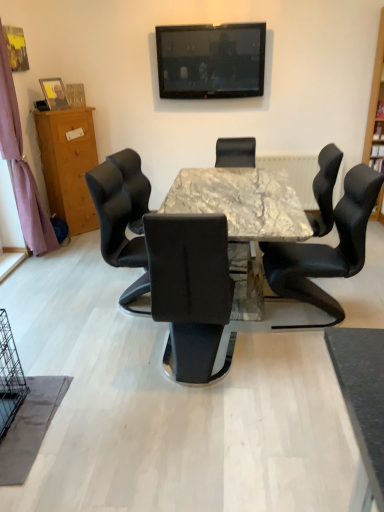
Question: Is wooden cabinet at left behind black glossy television at upper center?

Choices:
 (A) yes
 (B) no

Answer: (B)

Question: From a real-world perspective, is wooden cabinet at left positioned under black glossy television at upper center based on gravity?

Choices:
 (A) yes
 (B) no

Answer: (A)

Question: Is wooden cabinet at left located outside black glossy television at upper center?

Choices:
 (A) no
 (B) yes

Answer: (B)

Question: Is wooden cabinet at left wider than black glossy television at upper center?

Choices:
 (A) yes
 (B) no

Answer: (A)

Question: Does wooden cabinet at left have a lesser height compared to black glossy television at upper center?

Choices:
 (A) yes
 (B) no

Answer: (B)

Question: In terms of width, does black leather chair at center, which is the 2th chair in back-to-front order, look wider or thinner when compared to purple fabric curtain at left?

Choices:
 (A) wide
 (B) thin

Answer: (A)

Question: From a real-world perspective, is black leather chair at center, positioned as the second chair in front-to-back order, physically located above or below purple fabric curtain at left?

Choices:
 (A) above
 (B) below

Answer: (B)

Question: Is point (319, 233) positioned closer to the camera than point (48, 239)?

Choices:
 (A) farther
 (B) closer

Answer: (B)

Question: Considering the positions of black leather chair at center, which is the 2th chair in back-to-front order, and purple fabric curtain at left in the image, is black leather chair at center, which is the 2th chair in back-to-front order, taller or shorter than purple fabric curtain at left?

Choices:
 (A) tall
 (B) short

Answer: (B)

Question: In the image, is black glossy television at upper center positioned in front of or behind marble table at center?

Choices:
 (A) front
 (B) behind

Answer: (B)

Question: In terms of size, does black glossy television at upper center appear bigger or smaller than marble table at center?

Choices:
 (A) big
 (B) small

Answer: (B)

Question: Is black glossy television at upper center to the left or to the right of marble table at center in the image?

Choices:
 (A) right
 (B) left

Answer: (B)

Question: In terms of height, does black glossy television at upper center look taller or shorter compared to marble table at center?

Choices:
 (A) short
 (B) tall

Answer: (A)

Question: From their relative heights in the image, would you say matte wooden picture frame at left is taller or shorter than black glossy television at upper center?

Choices:
 (A) tall
 (B) short

Answer: (B)

Question: Is matte wooden picture frame at left bigger or smaller than black glossy television at upper center?

Choices:
 (A) small
 (B) big

Answer: (A)